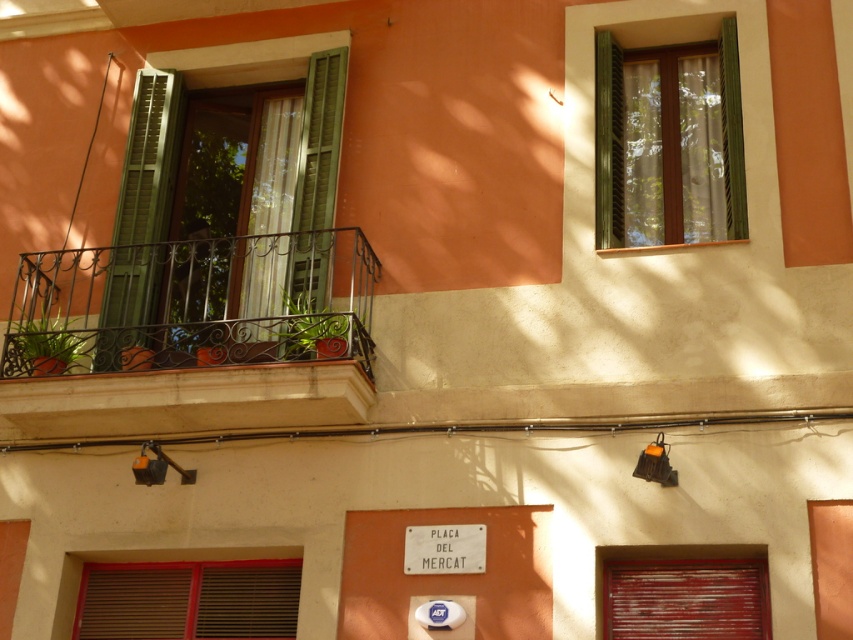
You are standing in front of the building and want to place a small statue between the two points, point (224, 289) and point (706, 60). Since you want the statue to be as close as possible to the viewer, which point should you place it closer to?

You should place the statue closer to point (224, 289) because it is closer to the viewer than point (706, 60).